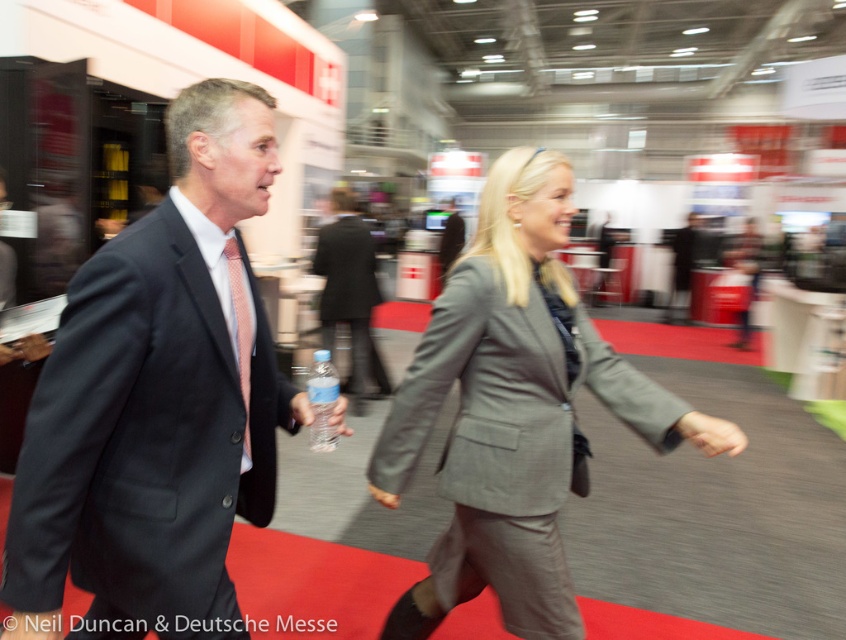
You are at the convention and need to find the dark gray suit at center. According to the coordinates provided, where exactly is it positioned?

The dark gray suit at center is located at point 0.628 along the x axis and 0.187 along the y axis.

You are a photographer at the convention. You want to take a photo that includes both the dark gray suit at center and the clear plastic bottle at center. Which object should you focus on first if you want to ensure the taller object is in sharp focus?

The clear plastic bottle at center is taller than the dark gray suit at center, so you should focus on the clear plastic bottle at center first to ensure it is in sharp focus.

You are a photographer at the convention. You want to take a photo of the dark gray suit at center and the clear plastic bottle at center. Which object is closer to the camera?

The dark gray suit at center is positioned under the clear plastic bottle at center, so the clear plastic bottle at center is closer to the camera.